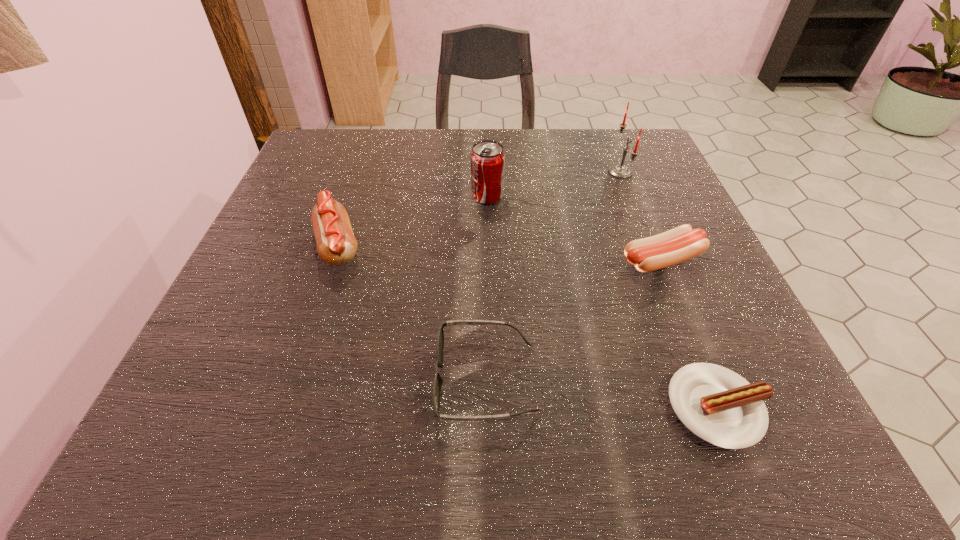
Where is `sausage that is at the near edge`? Image resolution: width=960 pixels, height=540 pixels. sausage that is at the near edge is located at coordinates (719, 406).

Where is `object that is at the left edge`? object that is at the left edge is located at coordinates (336, 244).

Locate an element on the screen. candle that is at the right edge is located at coordinates (617, 170).

Image resolution: width=960 pixels, height=540 pixels. In order to click on object located at the far right corner in this screenshot , I will do (617, 170).

I want to click on object positioned at the near right corner, so click(x=719, y=406).

You are a GUI agent. You are given a task and a screenshot of the screen. Output one action in this format:
    pyautogui.click(x=<x>, y=<y>)
    Task: Click on the free space at the far edge of the desktop
    This screenshot has width=960, height=540.
    Given the screenshot: What is the action you would take?
    pyautogui.click(x=562, y=152)

Where is `free space at the near edge of the desktop`? The image size is (960, 540). free space at the near edge of the desktop is located at coordinates (346, 424).

Image resolution: width=960 pixels, height=540 pixels. Find the location of `blank space at the left edge`. blank space at the left edge is located at coordinates (285, 321).

The height and width of the screenshot is (540, 960). In order to click on vacant space at the right edge in this screenshot , I will do `click(639, 191)`.

In order to click on vacant space at the near left corner of the desktop in this screenshot , I will do `click(252, 409)`.